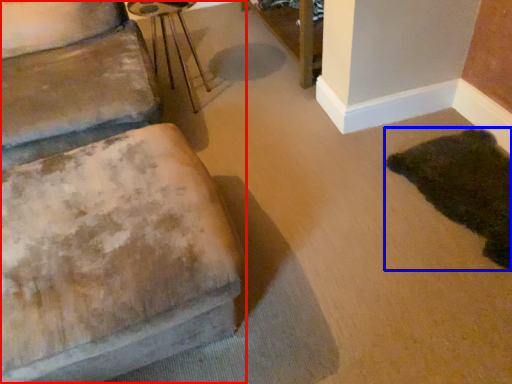
Question: Which object appears farthest to the camera in this image, furniture (highlighted by a red box) or animal (highlighted by a blue box)?

Choices:
 (A) furniture
 (B) animal

Answer: (B)